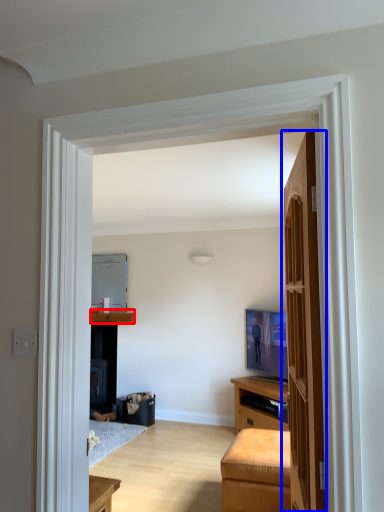
Question: Among these objects, which one is nearest to the camera, cabinetry (highlighted by a red box) or door (highlighted by a blue box)?

Choices:
 (A) cabinetry
 (B) door

Answer: (B)